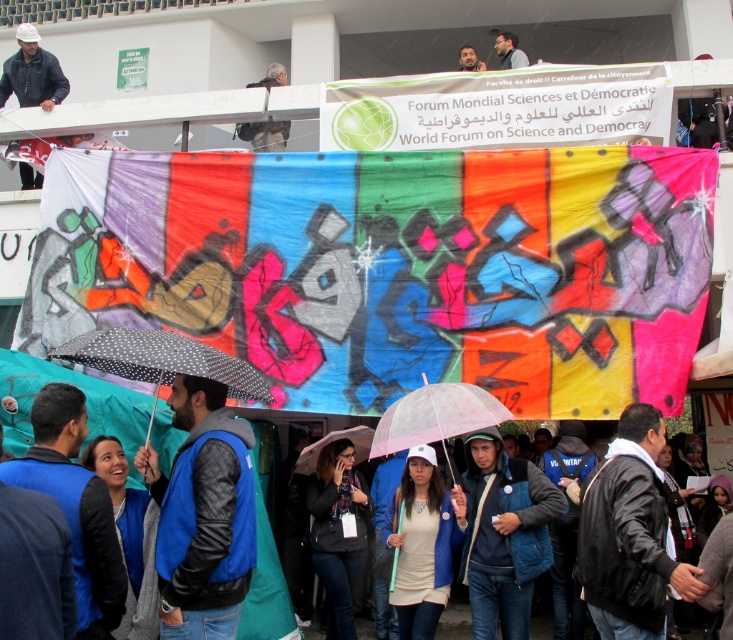
You are attending an event at the Faculty of Law and want to take a photo of the banner with your matte black camera at upper center. However, there is a transparent plastic umbrella at center in the way. Can you adjust your position so the camera can capture the entire banner without the umbrella blocking it?

The transparent plastic umbrella at center is shorter than the matte black camera at upper center. Since the umbrella is shorter, you can raise the camera higher to position it above the umbrella, allowing the matte black camera at upper center to capture the entire banner without obstruction.

From the picture: You are organizing a photo shoot and need to ensure that the blue denim jacket at center and the white matte baseball cap at center are both visible in the frame. Given their sizes, which object should you prioritize positioning closer to the camera to maintain clarity?

The blue denim jacket at center is wider than the white matte baseball cap at center, so you should prioritize positioning the blue denim jacket at center closer to the camera to ensure both objects are clearly visible.

You are standing in the outdoor scene described and want to pick up the transparent plastic umbrella at center and the pink matte umbrella at center. Which one would you reach first if you move towards them?

You would reach the transparent plastic umbrella at center first because it is closer to you than the pink matte umbrella at center.